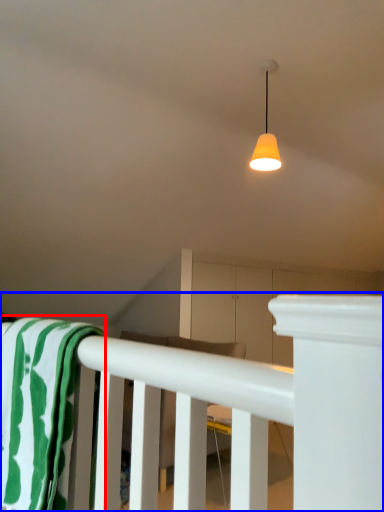
Question: Which object is closer to the camera taking this photo, beach towel (highlighted by a red box) or rail (highlighted by a blue box)?

Choices:
 (A) beach towel
 (B) rail

Answer: (A)